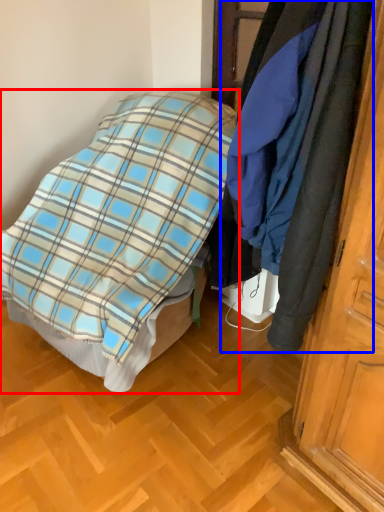
Question: Which object appears closest to the camera in this image, bed (highlighted by a red box) or cloak (highlighted by a blue box)?

Choices:
 (A) bed
 (B) cloak

Answer: (B)